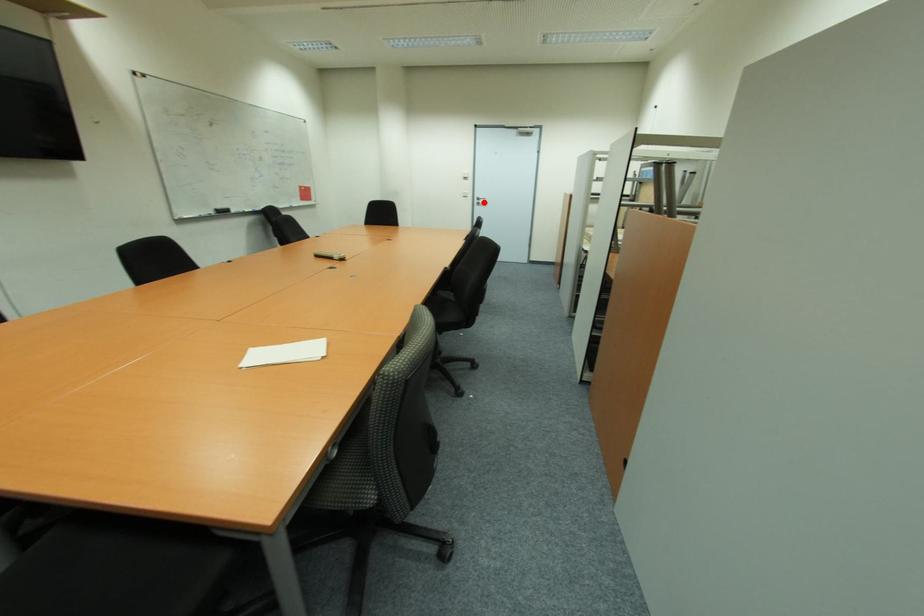
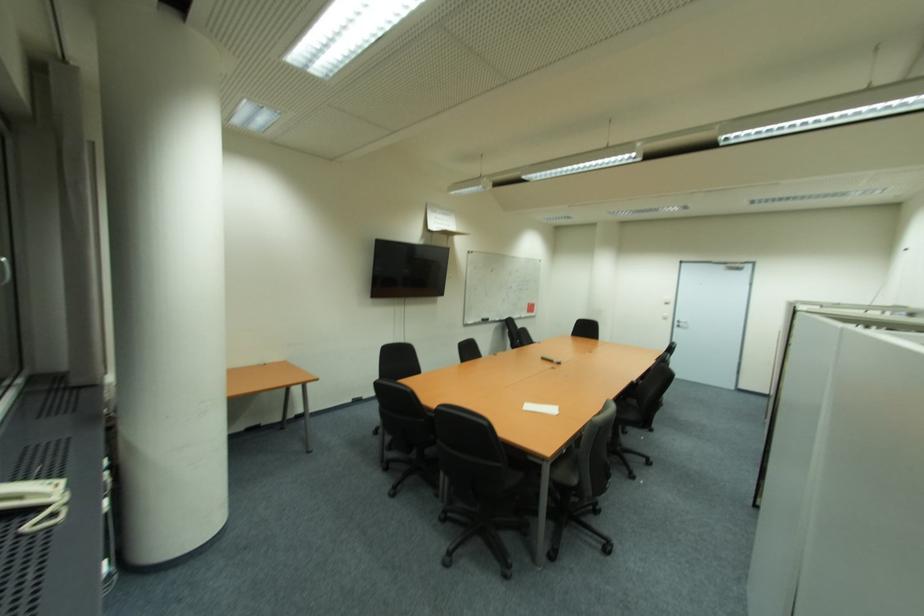
The point at the highlighted location is marked in the first image. Where is the corresponding point in the second image?

(686, 325)